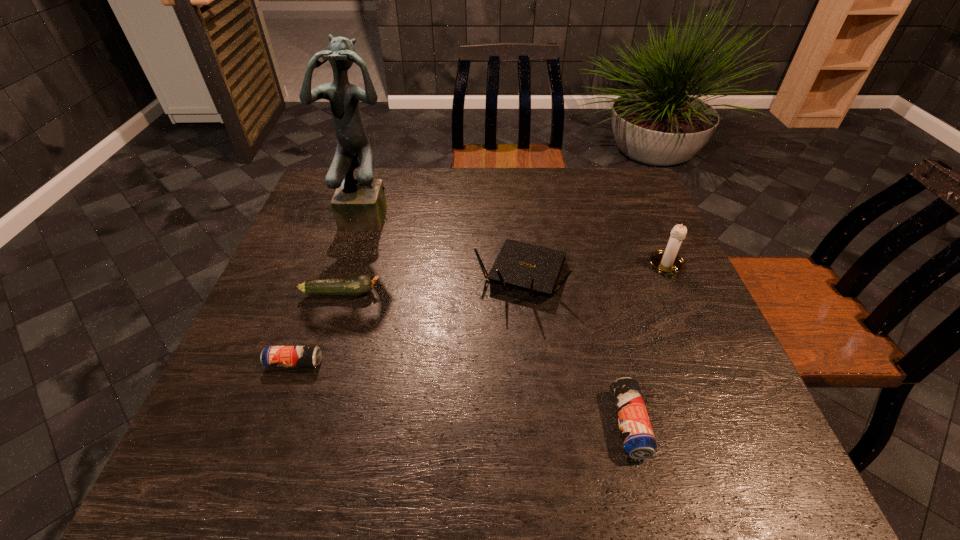
If equal spacing is desired by inserting an extra beer_can among them, please point out a free spot for this new beer_can. Please provide its 2D coordinates. Your answer should be formatted as a tuple, i.e. [(x, y)], where the tuple contains the x and y coordinates of a point satisfying the conditions above.

[(452, 392)]